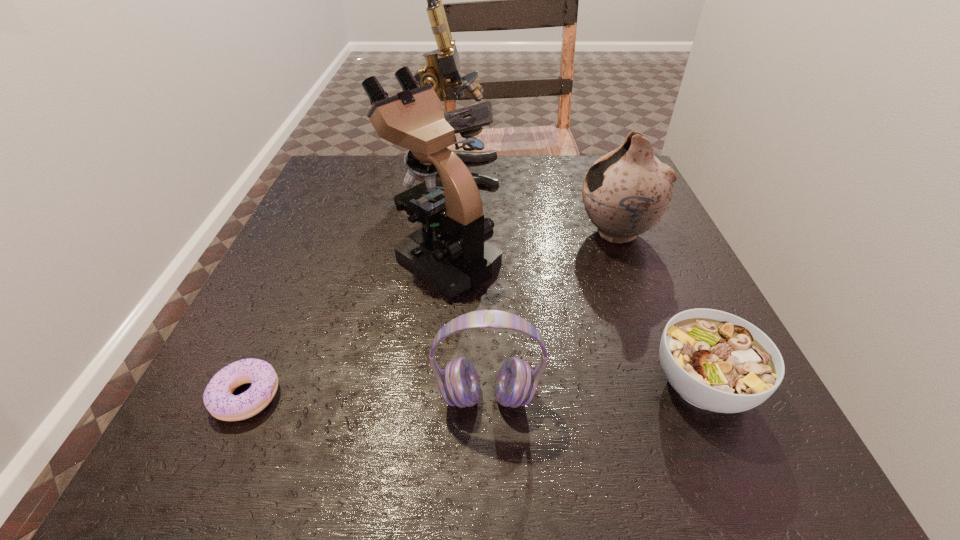
The width and height of the screenshot is (960, 540). I want to click on vacant space located 0.180m on the back of the nearer microscope, so point(450,183).

Locate an element on the screen. The image size is (960, 540). blank area located 0.060m from the spout of the third tallest object is located at coordinates (548, 233).

Locate an element on the screen. This screenshot has width=960, height=540. free point located from the spout of the third tallest object is located at coordinates (454, 233).

Identify the location of free region located from the spout of the third tallest object. (548, 233).

The width and height of the screenshot is (960, 540). Find the location of `vacant space located 0.050m on the headband and ear cups of the headset`. vacant space located 0.050m on the headband and ear cups of the headset is located at coordinates (489, 453).

Locate an element on the screen. The image size is (960, 540). vacant space located on the back of the soup bowl is located at coordinates (641, 246).

Find the location of `vacant space located 0.170m on the right of the leftmost object`. vacant space located 0.170m on the right of the leftmost object is located at coordinates (396, 396).

Where is `object that is at the far edge`? object that is at the far edge is located at coordinates (443, 63).

This screenshot has width=960, height=540. Find the location of `soup bowl present at the near edge`. soup bowl present at the near edge is located at coordinates (716, 361).

Where is `doughnut at the near edge`? The height and width of the screenshot is (540, 960). doughnut at the near edge is located at coordinates click(x=220, y=402).